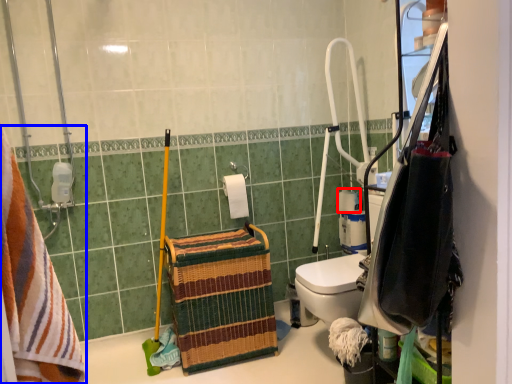
Question: Which of the following is the closest to the observer, toilet paper (highlighted by a red box) or towel (highlighted by a blue box)?

Choices:
 (A) toilet paper
 (B) towel

Answer: (B)